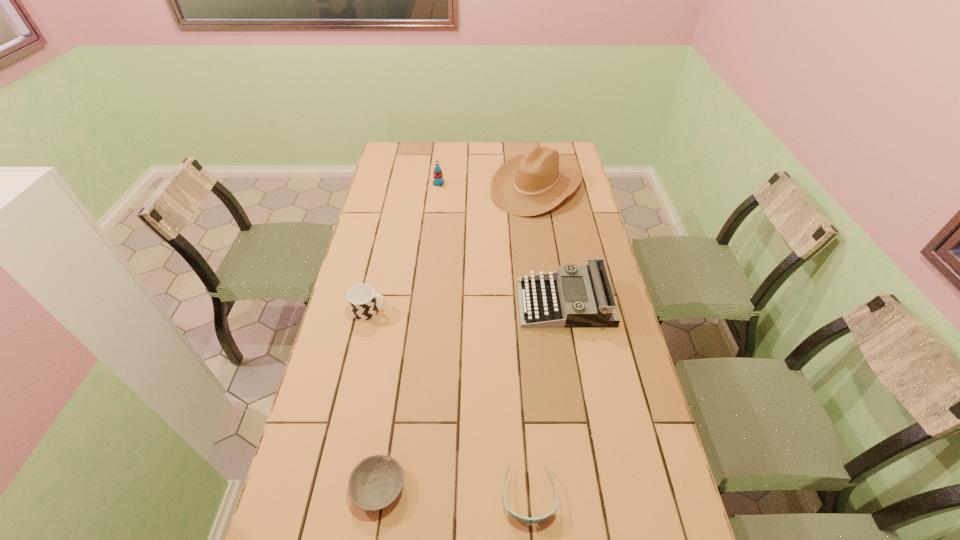
I want to click on cowboy hat, so click(x=526, y=185).

In order to click on soda in this screenshot , I will do `click(438, 176)`.

Locate an element on the screen. The image size is (960, 540). typewriter is located at coordinates (556, 299).

The width and height of the screenshot is (960, 540). Find the location of `the fourth tallest object`. the fourth tallest object is located at coordinates (362, 299).

This screenshot has width=960, height=540. I want to click on goggles, so click(x=522, y=519).

Locate an element on the screen. bowl is located at coordinates (376, 481).

At what (x,y) coordinates should I click in order to perform the action: click on free space located on the front of the cowboy hat. Please return your answer as a coordinate pair (x, y). Looking at the image, I should click on (542, 231).

Locate an element on the screen. This screenshot has height=540, width=960. vacant region located 0.270m on the back of the soda is located at coordinates (443, 149).

This screenshot has width=960, height=540. I want to click on free space located on the typing side of the typewriter, so click(x=466, y=302).

The width and height of the screenshot is (960, 540). I want to click on free space located 0.290m on the typing side of the typewriter, so click(x=432, y=302).